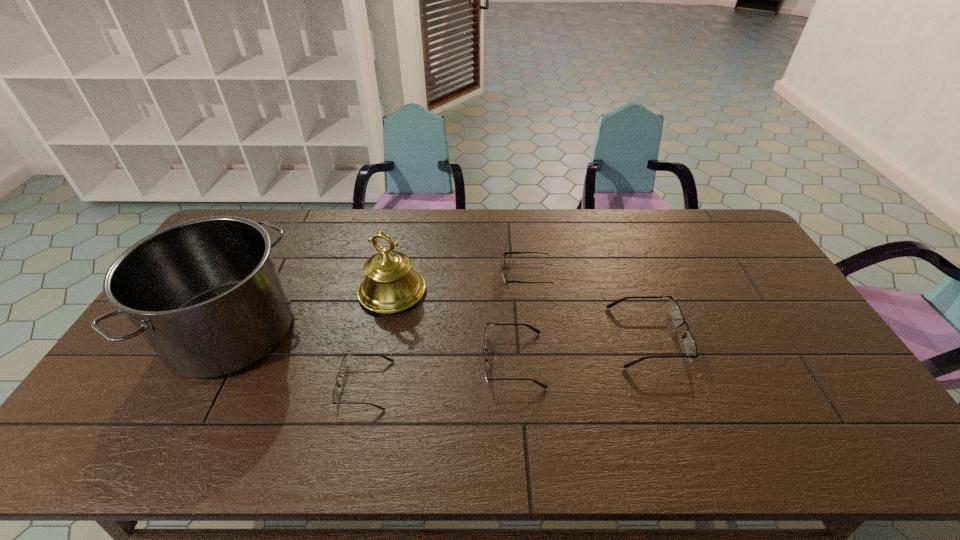
All spectacless are currently evenly spaced. To continue this pattern, where would you add another spectacles on the right? Please point out a vacant spot. Please provide its 2D coordinates. Your answer should be formatted as a tuple, i.e. [(x, y)], where the tuple contains the x and y coordinates of a point satisfying the conditions above.

[(771, 315)]